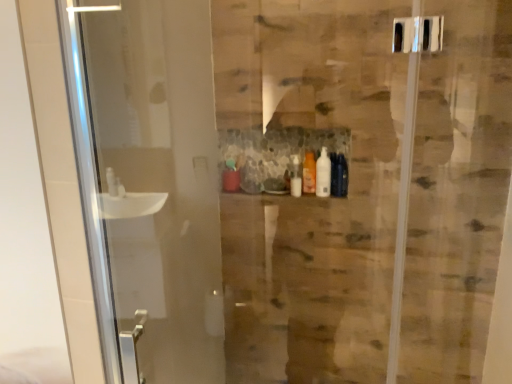
What are the coordinates of `matte green bottle at center, the second toiletry in the right-to-left sequence` in the screenshot? It's located at (231, 177).

What do you see at coordinates (231, 177) in the screenshot? I see `matte green bottle at center, positioned as the 1th toiletry in left-to-right order` at bounding box center [231, 177].

This screenshot has width=512, height=384. Describe the element at coordinates (309, 173) in the screenshot. I see `translucent orange bottle at center, the first toiletry in the right-to-left sequence` at that location.

What is the approximate height of translucent orange bottle at center, the first toiletry in the right-to-left sequence?

translucent orange bottle at center, the first toiletry in the right-to-left sequence, is 7.40 inches tall.

Identify the location of translucent orange bottle at center, the first toiletry in the right-to-left sequence. The height and width of the screenshot is (384, 512). (309, 173).

At what (x,y) coordinates should I click in order to perform the action: click on matte green bottle at center, positioned as the 1th toiletry in left-to-right order. Please return your answer as a coordinate pair (x, y). This screenshot has width=512, height=384. Looking at the image, I should click on (231, 177).

Based on their positions, is translucent orange bottle at center, which ranks as the 2th toiletry in left-to-right order, located to the left or right of matte green bottle at center, positioned as the 1th toiletry in left-to-right order?

Based on their positions, translucent orange bottle at center, which ranks as the 2th toiletry in left-to-right order, is located to the right of matte green bottle at center, positioned as the 1th toiletry in left-to-right order.

Considering the relative positions of translucent orange bottle at center, which ranks as the 2th toiletry in left-to-right order, and matte green bottle at center, positioned as the 1th toiletry in left-to-right order, in the image provided, is translucent orange bottle at center, which ranks as the 2th toiletry in left-to-right order, behind matte green bottle at center, positioned as the 1th toiletry in left-to-right order,?

No, translucent orange bottle at center, which ranks as the 2th toiletry in left-to-right order, is closer to the viewer.

Considering the positions of points (303, 175) and (233, 172), is point (303, 175) closer to camera compared to point (233, 172)?

That is True.

From the image's perspective, would you say translucent orange bottle at center, which ranks as the 2th toiletry in left-to-right order, is positioned over matte green bottle at center, positioned as the 1th toiletry in left-to-right order?

Yes.

From a real-world perspective, is translucent orange bottle at center, the first toiletry in the right-to-left sequence, beneath matte green bottle at center, positioned as the 1th toiletry in left-to-right order?

Incorrect, from a real-world perspective, translucent orange bottle at center, the first toiletry in the right-to-left sequence, is higher than matte green bottle at center, positioned as the 1th toiletry in left-to-right order.

Does translucent orange bottle at center, which ranks as the 2th toiletry in left-to-right order, have a greater width compared to matte green bottle at center, the second toiletry in the right-to-left sequence?

Incorrect, the width of translucent orange bottle at center, which ranks as the 2th toiletry in left-to-right order, does not surpass that of matte green bottle at center, the second toiletry in the right-to-left sequence.

Can you confirm if translucent orange bottle at center, which ranks as the 2th toiletry in left-to-right order, is shorter than matte green bottle at center, positioned as the 1th toiletry in left-to-right order?

No.

Considering the sizes of objects translucent orange bottle at center, the first toiletry in the right-to-left sequence, and matte green bottle at center, the second toiletry in the right-to-left sequence, in the image provided, who is bigger, translucent orange bottle at center, the first toiletry in the right-to-left sequence, or matte green bottle at center, the second toiletry in the right-to-left sequence,?

matte green bottle at center, the second toiletry in the right-to-left sequence.

Is translucent orange bottle at center, the first toiletry in the right-to-left sequence, not inside matte green bottle at center, the second toiletry in the right-to-left sequence?

Yes, translucent orange bottle at center, the first toiletry in the right-to-left sequence, is outside of matte green bottle at center, the second toiletry in the right-to-left sequence.

Can you see translucent orange bottle at center, which ranks as the 2th toiletry in left-to-right order, touching matte green bottle at center, positioned as the 1th toiletry in left-to-right order?

No, translucent orange bottle at center, which ranks as the 2th toiletry in left-to-right order, is not next to matte green bottle at center, positioned as the 1th toiletry in left-to-right order.

Could you tell me if translucent orange bottle at center, the first toiletry in the right-to-left sequence, is turned towards matte green bottle at center, the second toiletry in the right-to-left sequence?

No, translucent orange bottle at center, the first toiletry in the right-to-left sequence, does not turn towards matte green bottle at center, the second toiletry in the right-to-left sequence.

Where is `toiletry that is on the left side of translucent orange bottle at center, the first toiletry in the right-to-left sequence`? toiletry that is on the left side of translucent orange bottle at center, the first toiletry in the right-to-left sequence is located at coordinates (231, 177).

Is matte green bottle at center, positioned as the 1th toiletry in left-to-right order, at the right side of translucent orange bottle at center, which ranks as the 2th toiletry in left-to-right order?

No.

Looking at this image, which object is closer to the camera taking this photo, matte green bottle at center, positioned as the 1th toiletry in left-to-right order, or translucent orange bottle at center, the first toiletry in the right-to-left sequence?

translucent orange bottle at center, the first toiletry in the right-to-left sequence, is more forward.

Is point (224, 179) positioned behind point (315, 173)?

Yes, it is.

In the scene shown: From the image's perspective, which one is positioned lower, matte green bottle at center, positioned as the 1th toiletry in left-to-right order, or translucent orange bottle at center, which ranks as the 2th toiletry in left-to-right order?

matte green bottle at center, positioned as the 1th toiletry in left-to-right order.

From a real-world perspective, which is physically above, matte green bottle at center, the second toiletry in the right-to-left sequence, or translucent orange bottle at center, which ranks as the 2th toiletry in left-to-right order?

translucent orange bottle at center, which ranks as the 2th toiletry in left-to-right order, from a real-world perspective.

Is matte green bottle at center, the second toiletry in the right-to-left sequence, wider or thinner than translucent orange bottle at center, the first toiletry in the right-to-left sequence?

Clearly, matte green bottle at center, the second toiletry in the right-to-left sequence, has more width compared to translucent orange bottle at center, the first toiletry in the right-to-left sequence.

Which of these two, matte green bottle at center, positioned as the 1th toiletry in left-to-right order, or translucent orange bottle at center, the first toiletry in the right-to-left sequence, stands shorter?

matte green bottle at center, positioned as the 1th toiletry in left-to-right order.

Who is smaller, matte green bottle at center, the second toiletry in the right-to-left sequence, or translucent orange bottle at center, the first toiletry in the right-to-left sequence?

With smaller size is translucent orange bottle at center, the first toiletry in the right-to-left sequence.

Is matte green bottle at center, positioned as the 1th toiletry in left-to-right order, located outside translucent orange bottle at center, the first toiletry in the right-to-left sequence?

Yes, matte green bottle at center, positioned as the 1th toiletry in left-to-right order, is outside of translucent orange bottle at center, the first toiletry in the right-to-left sequence.

Is matte green bottle at center, positioned as the 1th toiletry in left-to-right order, in contact with translucent orange bottle at center, which ranks as the 2th toiletry in left-to-right order?

matte green bottle at center, positioned as the 1th toiletry in left-to-right order, and translucent orange bottle at center, which ranks as the 2th toiletry in left-to-right order, are clearly separated.

Is matte green bottle at center, the second toiletry in the right-to-left sequence, turned away from translucent orange bottle at center, which ranks as the 2th toiletry in left-to-right order?

matte green bottle at center, the second toiletry in the right-to-left sequence, does not have its back to translucent orange bottle at center, which ranks as the 2th toiletry in left-to-right order.

The image size is (512, 384). I want to click on toiletry that appears above the matte green bottle at center, positioned as the 1th toiletry in left-to-right order (from a real-world perspective), so click(309, 173).

Find the location of a particular element. The height and width of the screenshot is (384, 512). toiletry lying in front of the matte green bottle at center, the second toiletry in the right-to-left sequence is located at coordinates (309, 173).

Where is `toiletry below the translucent orange bottle at center, which ranks as the 2th toiletry in left-to-right order (from the image's perspective)`? This screenshot has height=384, width=512. toiletry below the translucent orange bottle at center, which ranks as the 2th toiletry in left-to-right order (from the image's perspective) is located at coordinates click(231, 177).